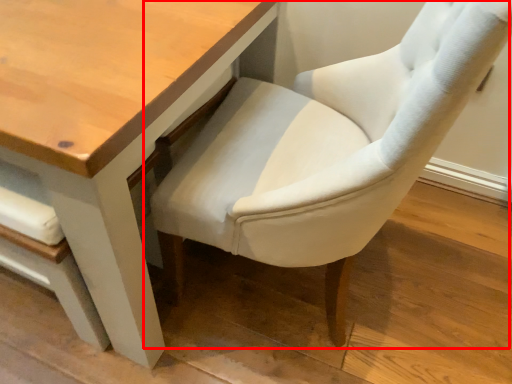
Question: Considering the relative positions of chair (annotated by the red box) and table in the image provided, where is chair (annotated by the red box) located with respect to the staircase?

Choices:
 (A) left
 (B) right

Answer: (B)